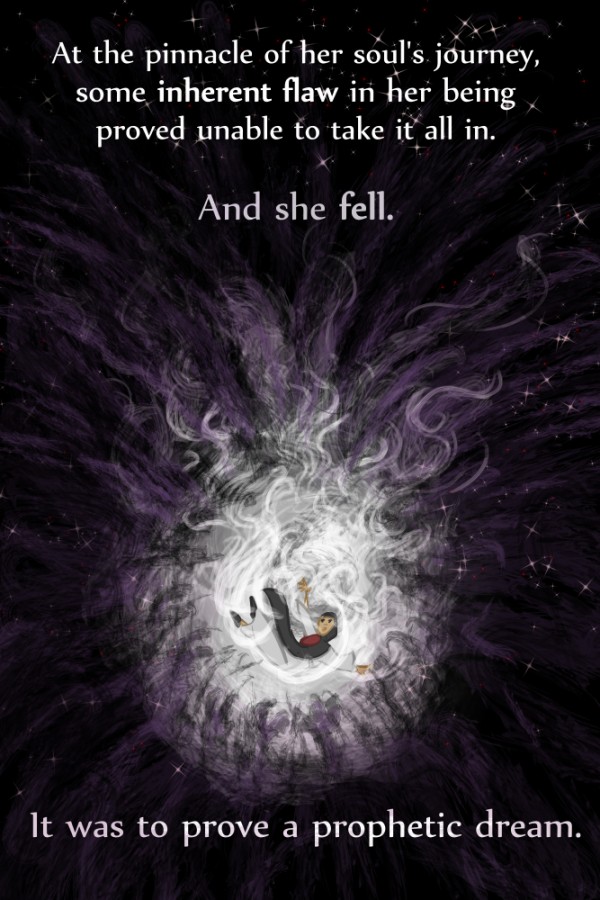
You are a GUI agent. You are given a task and a screenshot of the screen. Output one action in this format:
    pyautogui.click(x=<x>, y=<y>)
    Task: Click on the painting
    The width and height of the screenshot is (600, 900).
    Given the screenshot: What is the action you would take?
    pyautogui.click(x=466, y=706)